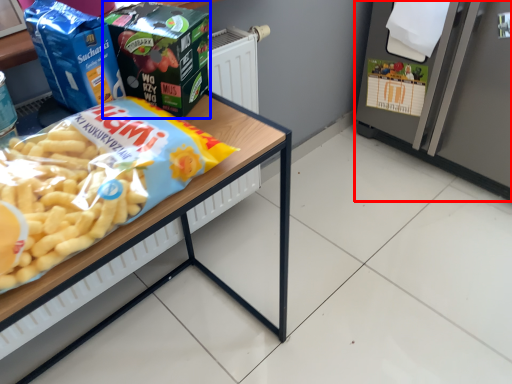
Question: Which object appears closest to the camera in this image, appliance (highlighted by a red box) or product (highlighted by a blue box)?

Choices:
 (A) appliance
 (B) product

Answer: (B)